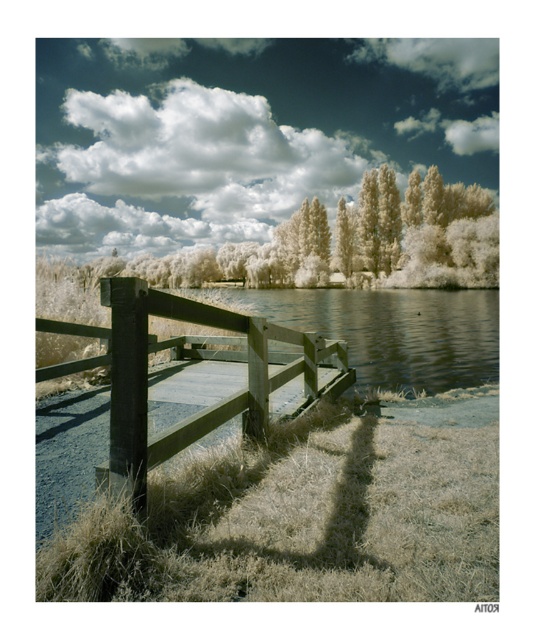
You are an artist trying to paint the scene. You want to ensure the white fluffy cloud at upper center and the wooden fence at center are proportionally accurate. Which object should you paint larger?

The white fluffy cloud at upper center should be painted larger since it has a larger size compared to the wooden fence at center.

You are standing in the landscape scene and want to take a photo of the wooden fence at center without the white fluffy cloud at upper center appearing in the frame. Which direction should you move to achieve this?

Move downward, as the white fluffy cloud at upper center is positioned over the wooden fence at center. By moving downward, you can position the camera below the cloud to exclude it from the frame.